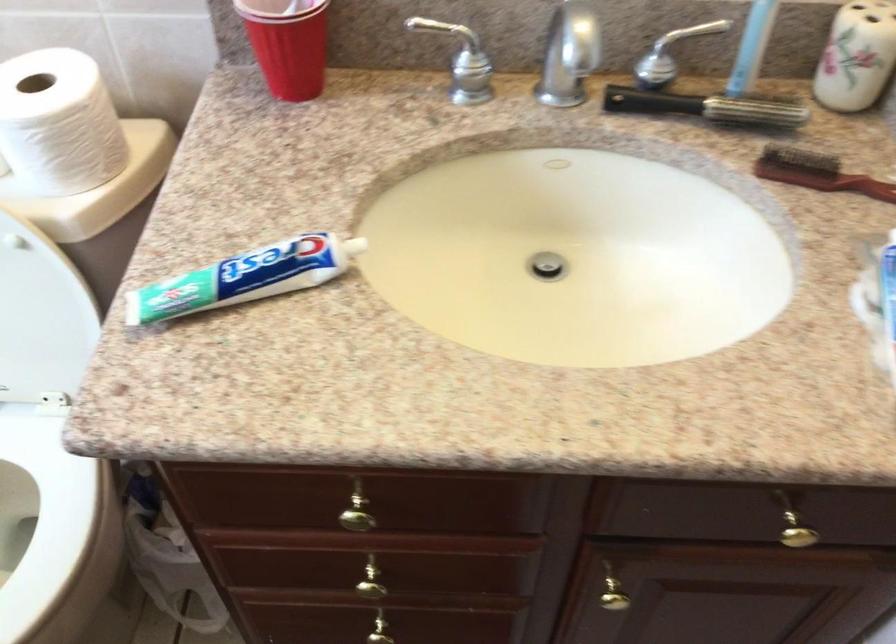
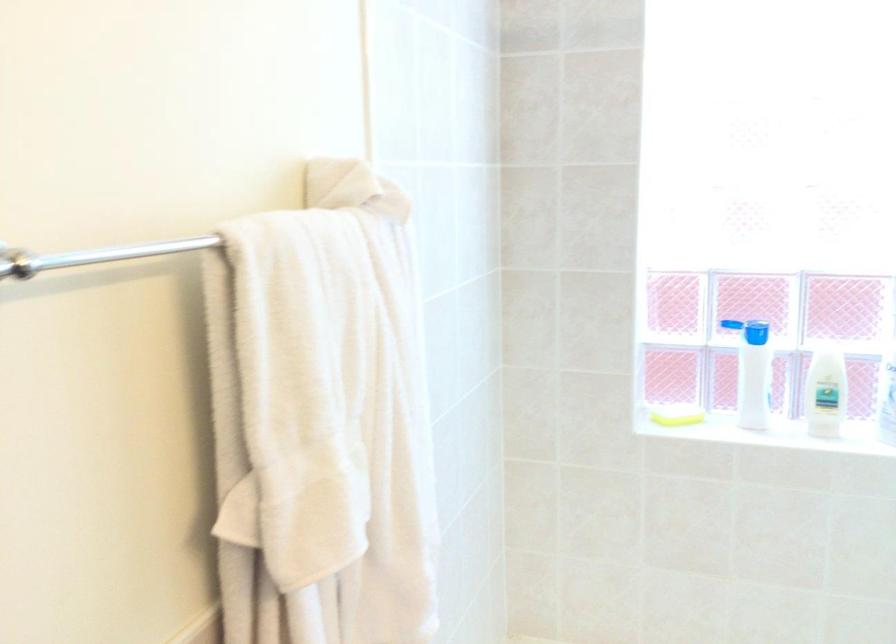
Looking at this image, based on the continuous images, in which direction is the camera rotating?

The rotation direction of the camera is left-down.